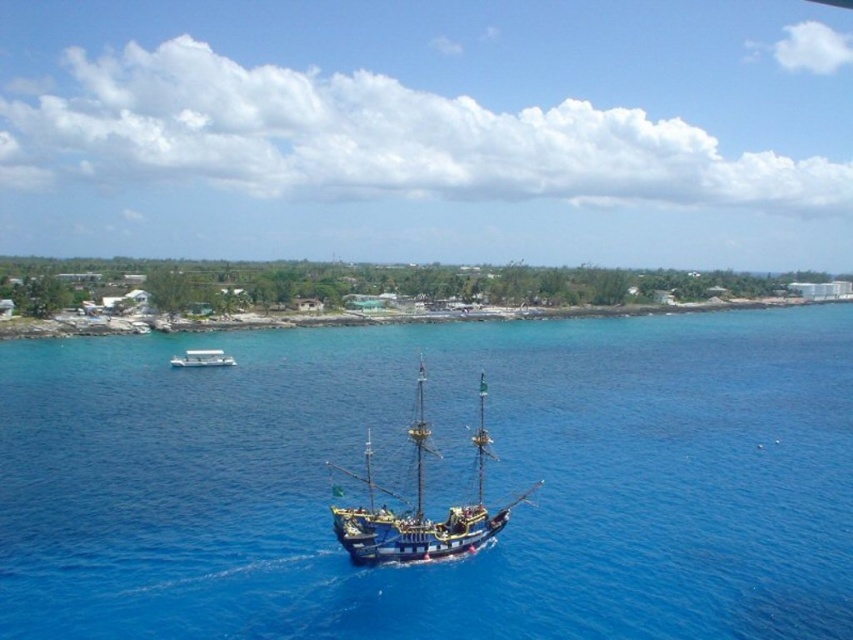
Is wooden pirate ship at center below white plastic boat at lower left?

Correct, wooden pirate ship at center is located below white plastic boat at lower left.

Which is behind, point (433, 557) or point (207, 364)?

The point (207, 364) is behind.

Where is `wooden pirate ship at center`? wooden pirate ship at center is located at coordinates (421, 506).

Where is `wooden pirate ship at center`? The width and height of the screenshot is (853, 640). wooden pirate ship at center is located at coordinates (421, 506).

Does point (225, 611) come behind point (448, 513)?

That is False.

Is blue water at center smaller than wooden pirate ship at center?

Actually, blue water at center might be larger than wooden pirate ship at center.

The image size is (853, 640). I want to click on blue water at center, so (436, 481).

Does blue water at center have a lesser width compared to white plastic boat at lower left?

In fact, blue water at center might be wider than white plastic boat at lower left.

Does point (161, 449) come behind point (189, 364)?

No.

Where is `blue water at center`? This screenshot has height=640, width=853. blue water at center is located at coordinates (436, 481).